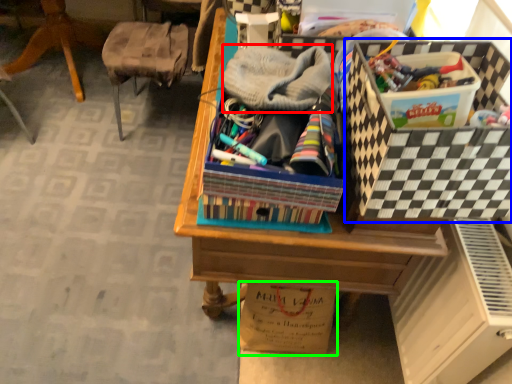
Question: Considering the real-world distances, which object is closest to clothing (highlighted by a red box)? storage box (highlighted by a blue box) or cardboard box (highlighted by a green box).

Choices:
 (A) storage box
 (B) cardboard box

Answer: (A)